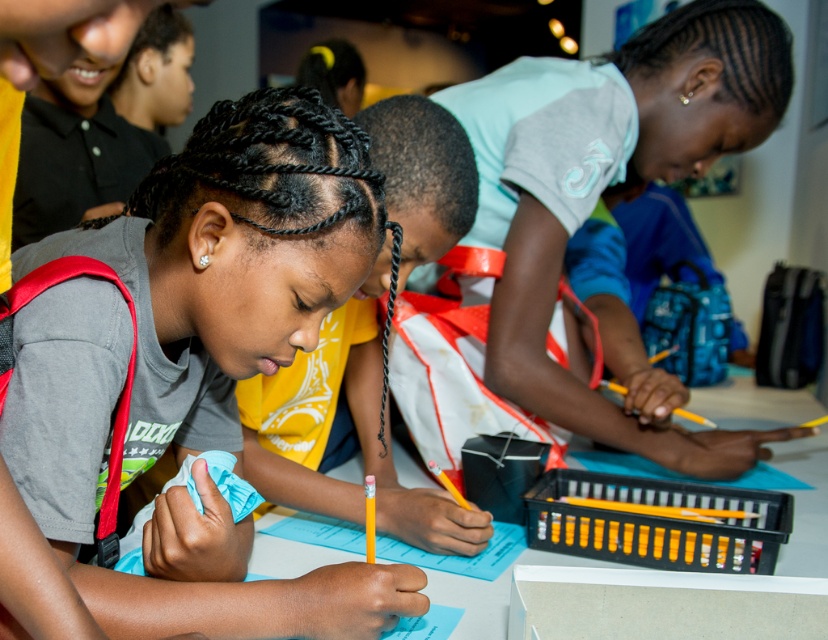
Question: From the image, what is the correct spatial relationship of matte gray shirt at center in relation to white plastic table at center?

Choices:
 (A) above
 (B) below

Answer: (A)

Question: Is light blue jersey at center smaller than white plastic table at center?

Choices:
 (A) no
 (B) yes

Answer: (B)

Question: Estimate the real-world distances between objects in this image. Which object is closer to the white plastic table at center?

Choices:
 (A) matte yellow shirt at center
 (B) light blue jersey at center

Answer: (A)

Question: Which of the following is the closest to the observer?

Choices:
 (A) light blue jersey at center
 (B) white plastic table at center
 (C) matte gray shirt at center
 (D) matte yellow shirt at center

Answer: (C)

Question: Which object is closer to the camera taking this photo?

Choices:
 (A) light blue jersey at center
 (B) matte yellow shirt at center

Answer: (B)

Question: Does light blue jersey at center lie behind matte yellow shirt at center?

Choices:
 (A) yes
 (B) no

Answer: (A)